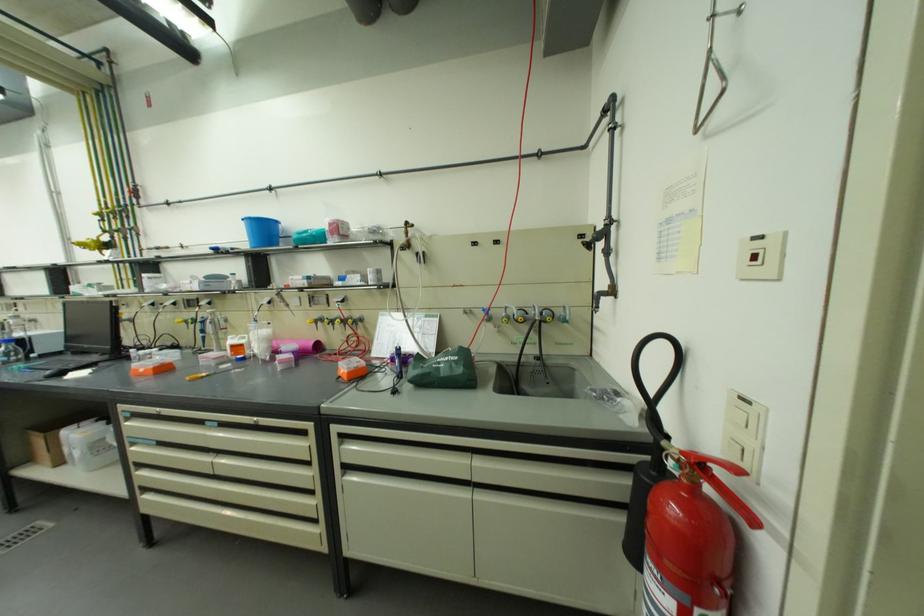
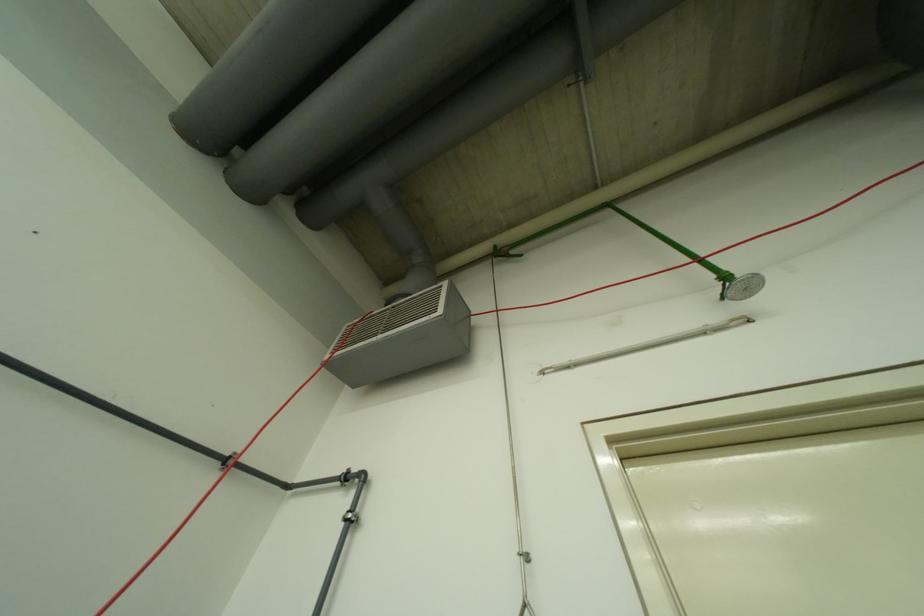
Consider the image. First-person continuous shooting, in which direction is the camera rotating?

The rotation direction of the camera is right-up.